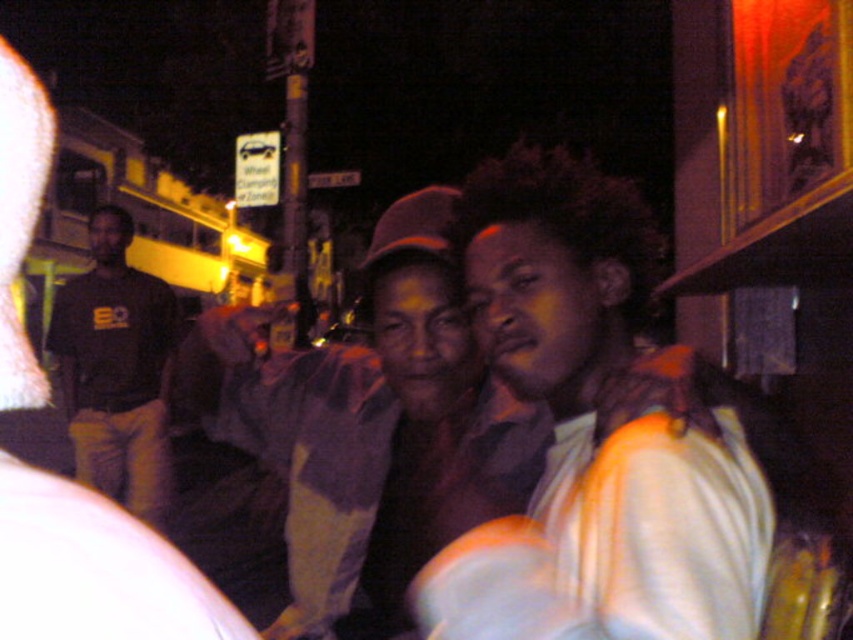
You are a photographer trying to capture a clear photo of both the light blue shirt at center and the matte black shirt at center in this dimly lit scene. Which shirt should you focus on first to ensure it appears sharp in the photo?

The light blue shirt at center is larger in size than the matte black shirt at center, so focusing on the light blue shirt at center first would ensure it appears sharp due to its larger size making it easier to focus on in low light.

You are a photographer trying to capture a photo of both the light blue shirt at center and the matte black shirt at center. Since the lighting is dim, you want to ensure both are visible. Which shirt should you focus on first to ensure it appears clear in the photo?

The light blue shirt at center is further to the viewer than the matte black shirt at center, so you should focus on the light blue shirt at center first to ensure both are in clear focus.

You are standing in the nighttime urban scene described. You notice a point at coordinates (595, 435). What object or feature is located at this point?

The point at coordinates (595, 435) corresponds to the light blue shirt at center.